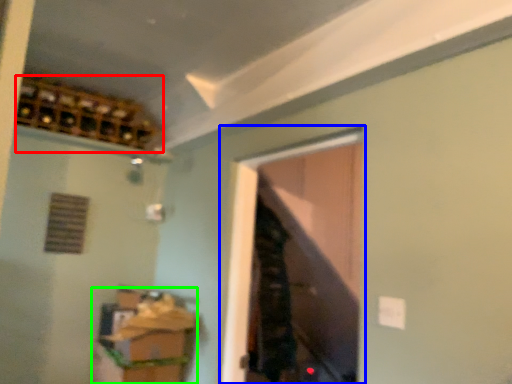
Question: Which is farther away from wine cabinet (highlighted by a red box)? window (highlighted by a blue box) or cabinetry (highlighted by a green box)?

Choices:
 (A) window
 (B) cabinetry

Answer: (A)